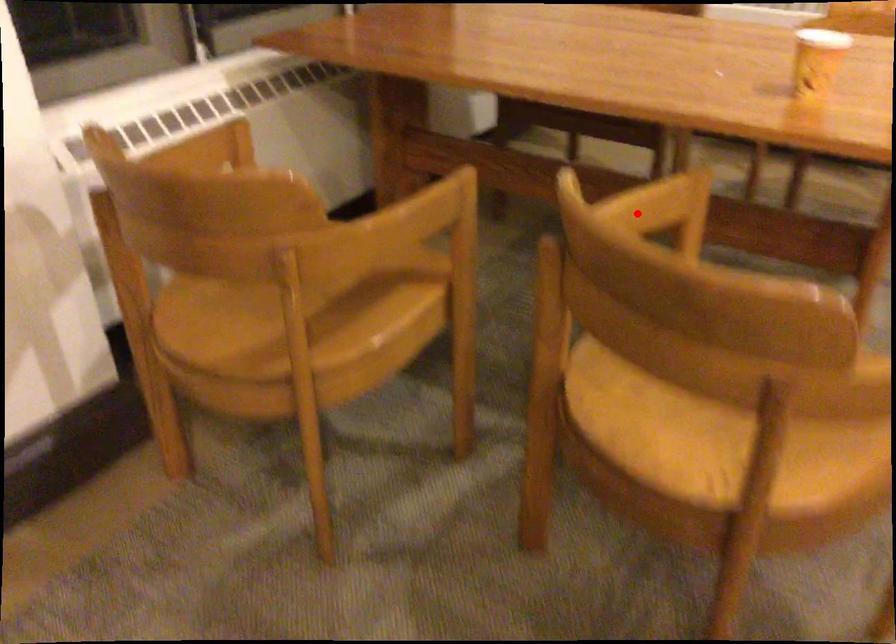
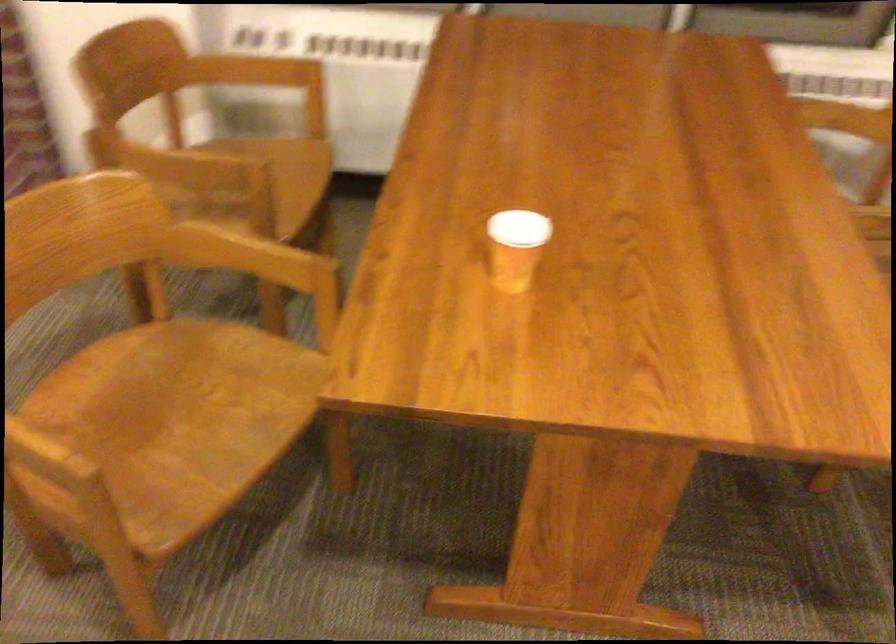
In the second image, find the point that corresponds to the highlighted location in the first image.

(248, 257)